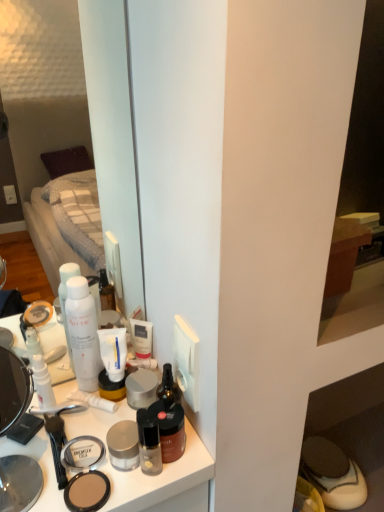
What are the coordinates of `vacant point to the left of white matte tube at center` in the screenshot? It's located at (47, 412).